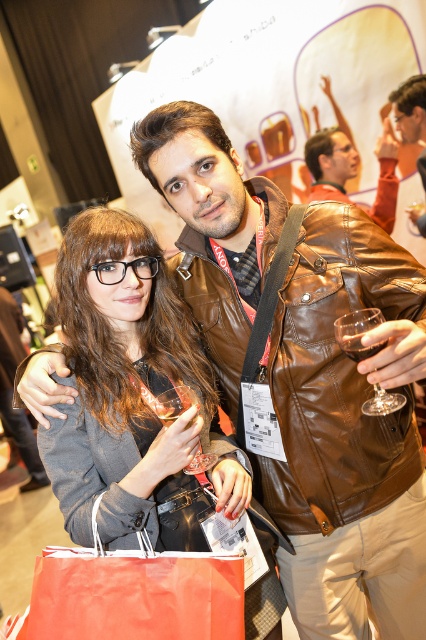
Between point (345, 154) and point (405, 396), which one is positioned in front?

Point (405, 396)

Does brown leather jacket at upper center have a larger size compared to transparent glass at right?

Yes.

Does point (307, 160) lie in front of point (400, 400)?

No, (307, 160) is further to viewer.

I want to click on brown leather jacket at upper center, so click(331, 163).

Can you confirm if orange paper bag at lower left is thinner than brown leather jacket at upper center?

Yes.

Does orange paper bag at lower left have a lesser height compared to brown leather jacket at upper center?

Yes, orange paper bag at lower left is shorter than brown leather jacket at upper center.

In order to click on orange paper bag at lower left in this screenshot , I will do `click(135, 595)`.

Locate an element on the screen. This screenshot has height=640, width=426. brown leather jacket at upper center is located at coordinates (331, 163).

Is point (307, 150) behind point (203, 458)?

That is True.

Locate an element on the screen. brown leather jacket at upper center is located at coordinates (331, 163).